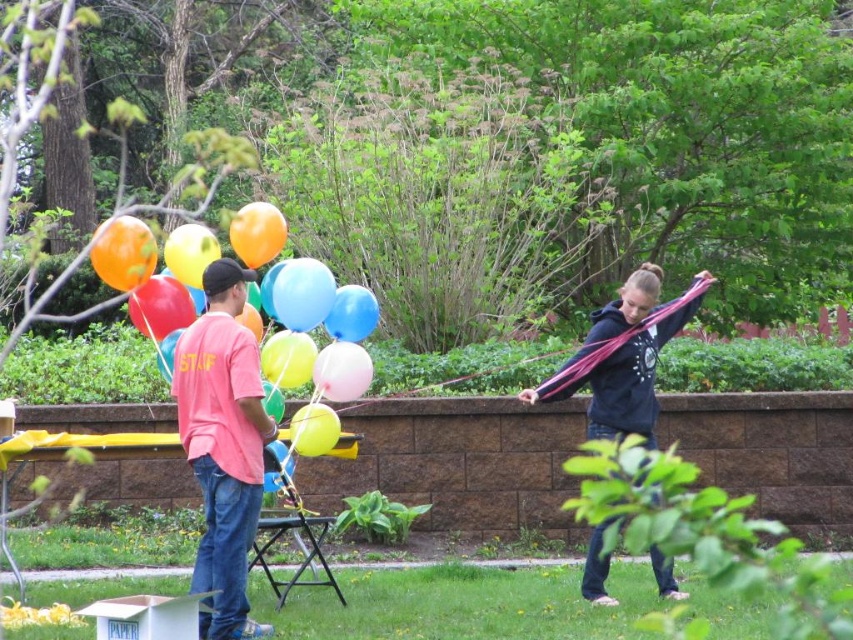
From the picture: Can you confirm if matte pink shirt at center is smaller than shiny multicolored balloons at left?

Incorrect, matte pink shirt at center is not smaller in size than shiny multicolored balloons at left.

Does point (196, 336) lie behind point (151, 326)?

No, (196, 336) is closer to viewer.

Is point (222, 528) closer to camera compared to point (132, 220)?

Yes, it is in front of point (132, 220).

Find the location of a particular element. The width and height of the screenshot is (853, 640). matte pink shirt at center is located at coordinates (223, 445).

Who is lower down, dark blue hoodie at center or shiny multicolored balloons at left?

dark blue hoodie at center is lower down.

Locate an element on the screen. dark blue hoodie at center is located at coordinates (624, 356).

Can you confirm if matte pink shirt at center is positioned to the left of dark blue hoodie at center?

Indeed, matte pink shirt at center is positioned on the left side of dark blue hoodie at center.

Is point (257, 476) behind point (590, 545)?

No.

Does point (212, 272) come in front of point (635, 278)?

Yes.

This screenshot has width=853, height=640. What are the coordinates of `matte pink shirt at center` in the screenshot? It's located at (223, 445).